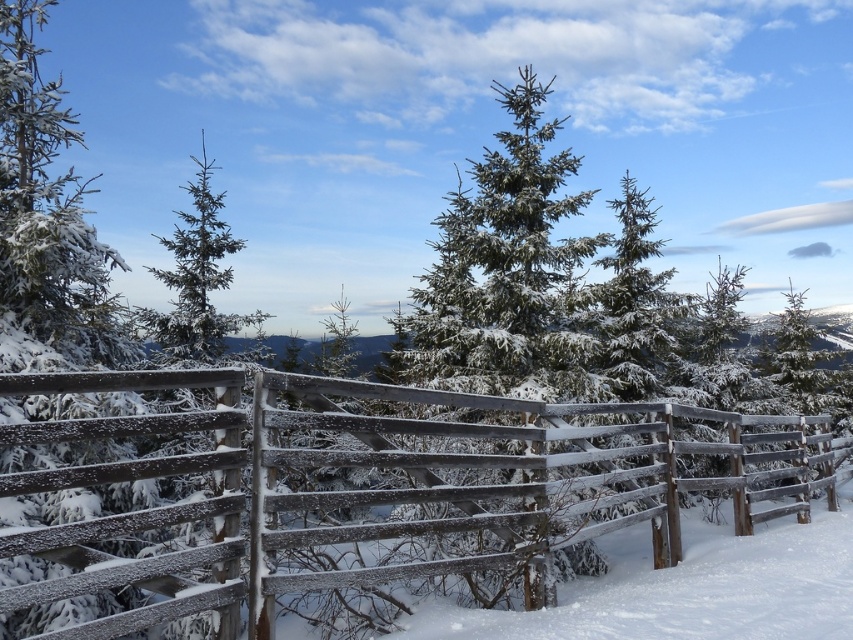
Question: Is frosted wood fence at center to the left of green matte tree at upper left from the viewer's perspective?

Choices:
 (A) no
 (B) yes

Answer: (A)

Question: Does frosted wood fence at center have a greater width compared to green matte tree at upper left?

Choices:
 (A) no
 (B) yes

Answer: (B)

Question: Can you confirm if frosted wood fence at center is smaller than green matte tree at upper left?

Choices:
 (A) no
 (B) yes

Answer: (B)

Question: Which of the following is the closest to the observer?

Choices:
 (A) (169, 356)
 (B) (186, 584)

Answer: (B)